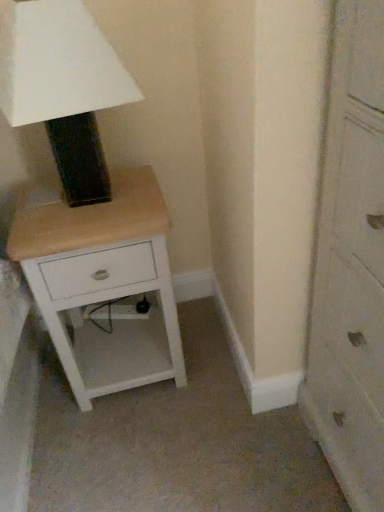
What is the approximate width of white wood nightstand at lower left?

white wood nightstand at lower left is 38.14 centimeters in width.

Image resolution: width=384 pixels, height=512 pixels. Find the location of `wooden chest of drawers at right`. wooden chest of drawers at right is located at coordinates (351, 264).

Which of these two, matte black lampshade at upper left or wooden chest of drawers at right, is wider?

wooden chest of drawers at right is wider.

Between matte black lampshade at upper left and wooden chest of drawers at right, which one has larger size?

wooden chest of drawers at right is bigger.

From the image's perspective, does matte black lampshade at upper left appear higher than wooden chest of drawers at right?

Yes.

Is matte black lampshade at upper left at the left side of wooden chest of drawers at right?

Indeed, matte black lampshade at upper left is positioned on the left side of wooden chest of drawers at right.

Measure the distance from wooden chest of drawers at right to white wood nightstand at lower left.

wooden chest of drawers at right and white wood nightstand at lower left are 23.40 inches apart.

Looking at this image, is wooden chest of drawers at right positioned far away from white wood nightstand at lower left?

No, wooden chest of drawers at right is not far away from white wood nightstand at lower left.

Does wooden chest of drawers at right have a lesser height compared to white wood nightstand at lower left?

Incorrect, the height of wooden chest of drawers at right does not fall short of that of white wood nightstand at lower left.

Considering their positions, is wooden chest of drawers at right located in front of or behind white wood nightstand at lower left?

wooden chest of drawers at right is in front of white wood nightstand at lower left.

How many degrees apart are the facing directions of white wood nightstand at lower left and matte black lampshade at upper left?

The angular difference between white wood nightstand at lower left and matte black lampshade at upper left is 0.00234 degrees.

From a real-world perspective, which is physically below, white wood nightstand at lower left or matte black lampshade at upper left?

white wood nightstand at lower left is physically lower.

Considering the sizes of objects white wood nightstand at lower left and matte black lampshade at upper left in the image provided, who is wider, white wood nightstand at lower left or matte black lampshade at upper left?

white wood nightstand at lower left is wider.

Looking at this image, is white wood nightstand at lower left taller than matte black lampshade at upper left?

Indeed, white wood nightstand at lower left has a greater height compared to matte black lampshade at upper left.

Is white wood nightstand at lower left located within matte black lampshade at upper left?

No, white wood nightstand at lower left is not inside matte black lampshade at upper left.

Would you consider matte black lampshade at upper left to be distant from white wood nightstand at lower left?

Actually, matte black lampshade at upper left and white wood nightstand at lower left are a little close together.

Between point (14, 103) and point (49, 218), which one is positioned in front?

The point (14, 103) is closer.

Locate an element on the screen. The height and width of the screenshot is (512, 384). nightstand that is behind the wooden chest of drawers at right is located at coordinates (103, 282).

Does white wood nightstand at lower left contain wooden chest of drawers at right?

No, wooden chest of drawers at right is not a part of white wood nightstand at lower left.

Does white wood nightstand at lower left touch wooden chest of drawers at right?

white wood nightstand at lower left is not next to wooden chest of drawers at right, and they're not touching.

From a real-world perspective, is wooden chest of drawers at right physically below matte black lampshade at upper left?

Yes, from a real-world perspective, wooden chest of drawers at right is beneath matte black lampshade at upper left.

Are wooden chest of drawers at right and matte black lampshade at upper left far apart?

No, wooden chest of drawers at right is not far from matte black lampshade at upper left.

How different are the orientations of wooden chest of drawers at right and matte black lampshade at upper left in degrees?

90 degrees.

In the scene shown: In terms of width, does wooden chest of drawers at right look wider or thinner when compared to matte black lampshade at upper left?

Clearly, wooden chest of drawers at right has more width compared to matte black lampshade at upper left.

Locate an element on the screen. The width and height of the screenshot is (384, 512). the chest of drawers located below the matte black lampshade at upper left (from the image's perspective) is located at coordinates (351, 264).

This screenshot has height=512, width=384. I want to click on nightstand above the wooden chest of drawers at right (from the image's perspective), so click(x=103, y=282).

Which object lies further to the anchor point white wood nightstand at lower left, matte black lampshade at upper left or wooden chest of drawers at right?

The object further to white wood nightstand at lower left is wooden chest of drawers at right.

Estimate the real-world distances between objects in this image. Which object is further from wooden chest of drawers at right, matte black lampshade at upper left or white wood nightstand at lower left?

matte black lampshade at upper left is further to wooden chest of drawers at right.

Looking at the image, which one is located further to white wood nightstand at lower left, wooden chest of drawers at right or matte black lampshade at upper left?

wooden chest of drawers at right is positioned further to the anchor white wood nightstand at lower left.

Looking at the image, which one is located further to wooden chest of drawers at right, white wood nightstand at lower left or matte black lampshade at upper left?

matte black lampshade at upper left is further to wooden chest of drawers at right.

Considering their positions, is wooden chest of drawers at right positioned closer to matte black lampshade at upper left than white wood nightstand at lower left?

Among the two, white wood nightstand at lower left is located nearer to matte black lampshade at upper left.

Considering their positions, is white wood nightstand at lower left positioned closer to matte black lampshade at upper left than wooden chest of drawers at right?

white wood nightstand at lower left is positioned closer to the anchor matte black lampshade at upper left.

You are a GUI agent. You are given a task and a screenshot of the screen. Output one action in this format:
    pyautogui.click(x=<x>, y=<y>)
    Task: Click on the nightstand between matte black lampshade at upper left and wooden chest of drawers at right
    This screenshot has height=512, width=384.
    Given the screenshot: What is the action you would take?
    pyautogui.click(x=103, y=282)